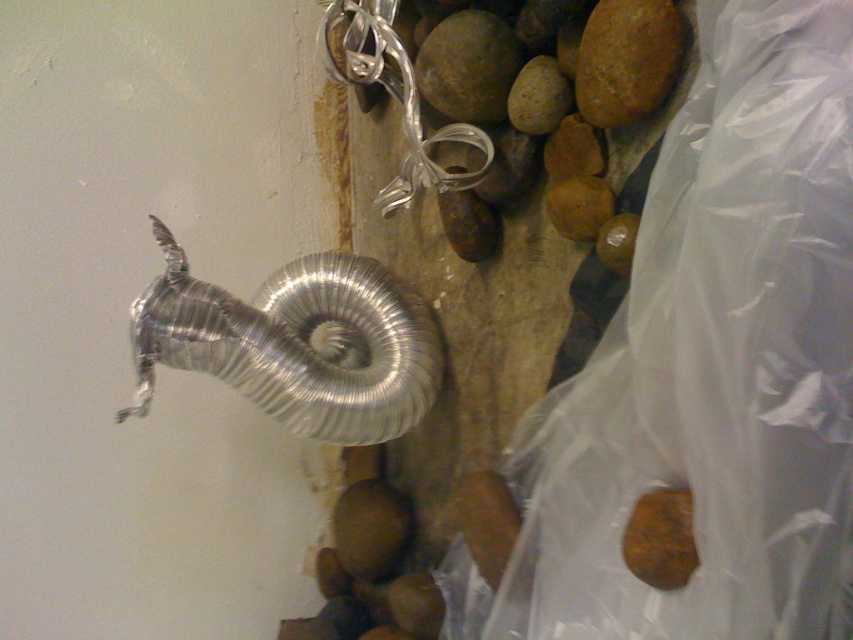
Is point (668, 45) more distant than point (512, 99)?

No, (668, 45) is closer to viewer.

Where is `smooth brown rock at upper right`? The width and height of the screenshot is (853, 640). smooth brown rock at upper right is located at coordinates (625, 60).

Can you confirm if smooth brown rock at upper center is bigger than smooth brown rock at center?

Correct, smooth brown rock at upper center is larger in size than smooth brown rock at center.

Does smooth brown rock at upper center lie in front of smooth brown rock at center?

No, it is behind smooth brown rock at center.

Does point (479, 120) come behind point (527, 125)?

Yes, point (479, 120) is behind point (527, 125).

The height and width of the screenshot is (640, 853). What are the coordinates of `smooth brown rock at upper center` in the screenshot? It's located at (468, 67).

Does metallic silver chain at upper center appear on the right side of smooth brown rock at center?

No, metallic silver chain at upper center is not to the right of smooth brown rock at center.

Who is lower down, metallic silver chain at upper center or smooth brown rock at center?

smooth brown rock at center is below.

Does point (463, 141) come behind point (543, 125)?

Yes, it is.

I want to click on metallic silver chain at upper center, so click(x=395, y=97).